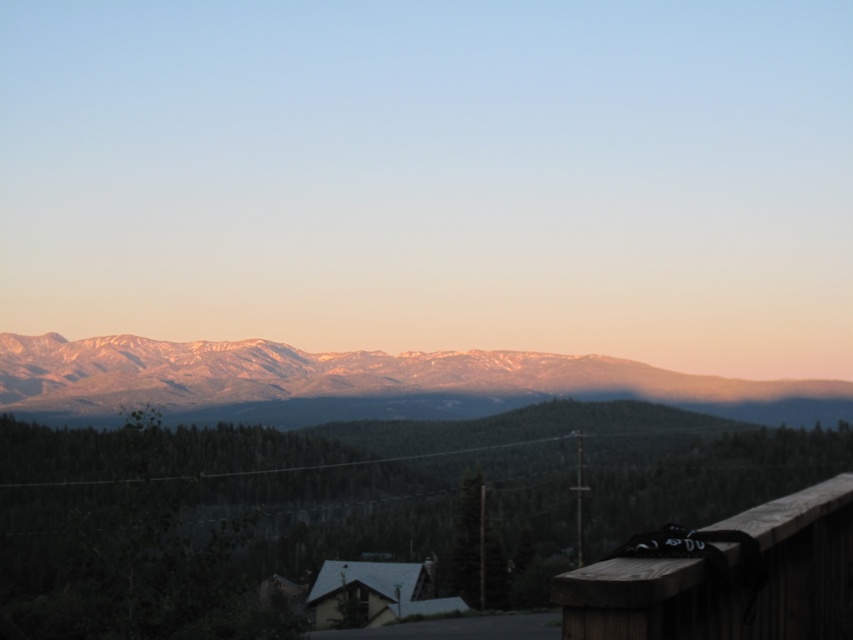
Who is positioned more to the right, snowy mountain range at upper center or wooden rail at lower right?

wooden rail at lower right

Is snowy mountain range at upper center thinner than wooden rail at lower right?

In fact, snowy mountain range at upper center might be wider than wooden rail at lower right.

Does point (57, 378) lie behind point (755, 618)?

Yes, it is behind point (755, 618).

In order to click on snowy mountain range at upper center in this screenshot , I will do `click(358, 381)`.